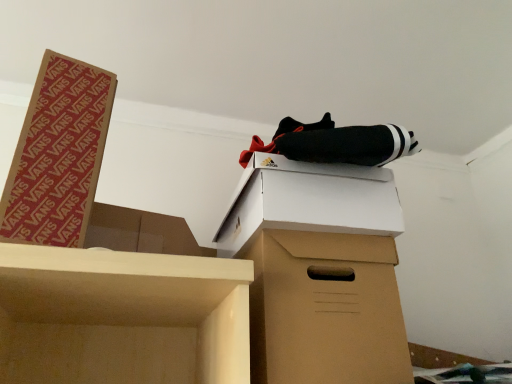
Question: From the image's perspective, is white cardboard box at upper center, which appears as the first box when viewed from the right, located above brown cardboard box at left, the first box from the left?

Choices:
 (A) yes
 (B) no

Answer: (B)

Question: Does white cardboard box at upper center, the second box viewed from the left, come in front of brown cardboard box at left, the first box from the left?

Choices:
 (A) no
 (B) yes

Answer: (A)

Question: Is the surface of white cardboard box at upper center, the second box viewed from the left, in direct contact with brown cardboard box at left, the first box from the left?

Choices:
 (A) no
 (B) yes

Answer: (A)

Question: Considering the relative positions of white cardboard box at upper center, the second box viewed from the left, and brown cardboard box at left, the first box from the left, in the image provided, is white cardboard box at upper center, the second box viewed from the left, to the right of brown cardboard box at left, the first box from the left, from the viewer's perspective?

Choices:
 (A) no
 (B) yes

Answer: (B)

Question: Can brown cardboard box at left, the first box from the left, be found inside white cardboard box at upper center, which appears as the first box when viewed from the right?

Choices:
 (A) no
 (B) yes

Answer: (A)

Question: Does white cardboard box at upper center, which appears as the first box when viewed from the right, have a larger size compared to brown cardboard box at left, which ranks as the second box in right-to-left order?

Choices:
 (A) yes
 (B) no

Answer: (A)

Question: Is brown cardboard box at left, which ranks as the second box in right-to-left order, facing away from white cardboard box at upper center, the second box viewed from the left?

Choices:
 (A) no
 (B) yes

Answer: (A)

Question: Can you confirm if brown cardboard box at left, the first box from the left, is taller than white cardboard box at upper center, which appears as the first box when viewed from the right?

Choices:
 (A) no
 (B) yes

Answer: (B)

Question: Can you confirm if brown cardboard box at left, which ranks as the second box in right-to-left order, is wider than white cardboard box at upper center, which appears as the first box when viewed from the right?

Choices:
 (A) no
 (B) yes

Answer: (A)

Question: Can you confirm if brown cardboard box at left, the first box from the left, is positioned to the left of white cardboard box at upper center, which appears as the first box when viewed from the right?

Choices:
 (A) no
 (B) yes

Answer: (B)

Question: From a real-world perspective, is brown cardboard box at left, which ranks as the second box in right-to-left order, located beneath white cardboard box at upper center, the second box viewed from the left?

Choices:
 (A) no
 (B) yes

Answer: (A)

Question: Considering the relative sizes of brown cardboard box at left, which ranks as the second box in right-to-left order, and white cardboard box at upper center, which appears as the first box when viewed from the right, in the image provided, is brown cardboard box at left, which ranks as the second box in right-to-left order, shorter than white cardboard box at upper center, which appears as the first box when viewed from the right,?

Choices:
 (A) yes
 (B) no

Answer: (B)

Question: Is brown cardboard box at left, which ranks as the second box in right-to-left order, shorter than brown cardboard box at center?

Choices:
 (A) yes
 (B) no

Answer: (B)